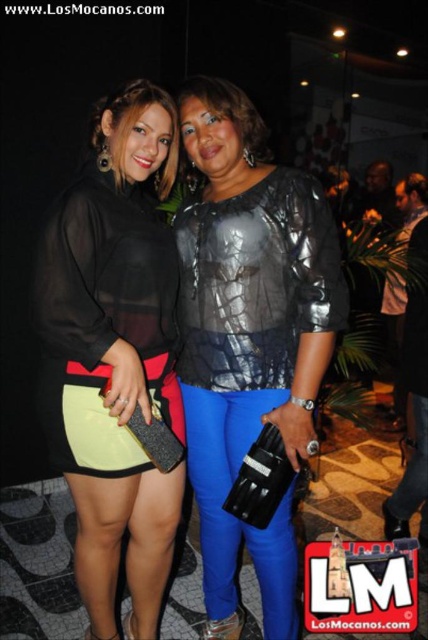
You are standing in the same room as the two women in the image. You notice two points marked at coordinates point(190, 316) and point(151, 314). Which point is closer to you?

Point(151, 314) is closer to you because it is in front of point(190, 316) according to the description.

You are a photographer at the event and need to ensure that both the metallic silver blouse at center and the matte black dress at center are visible in the photo. Based on their positions, which one should you focus on first to capture both effectively?

The metallic silver blouse at center is located above the matte black dress at center. To capture both effectively, focus on the metallic silver blouse at center first since it is positioned higher up, allowing the dress to naturally fall into the frame below.